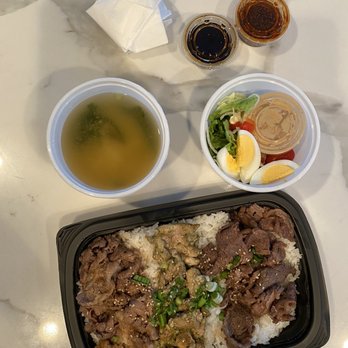
You are a GUI agent. You are given a task and a screenshot of the screen. Output one action in this format:
    pyautogui.click(x=<x>, y=<y>)
    Task: Click on the napkin
    
    Given the screenshot: What is the action you would take?
    pyautogui.click(x=132, y=20)